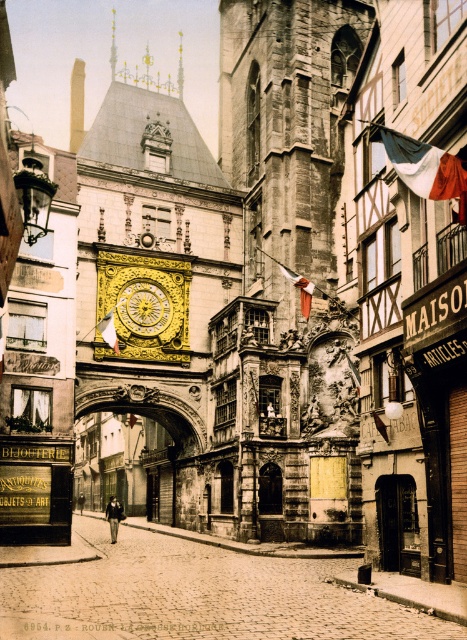
Can you confirm if stone textured tower at center is positioned to the right of gold polished clock at center?

Indeed, stone textured tower at center is positioned on the right side of gold polished clock at center.

Does point (322, 132) come behind point (128, 305)?

That is True.

Where is `stone textured tower at center`? The height and width of the screenshot is (640, 467). stone textured tower at center is located at coordinates (287, 269).

In the scene shown: Can you confirm if gold ornate archway at center is shorter than gold polished clock at center?

No, gold ornate archway at center is not shorter than gold polished clock at center.

Is gold ornate archway at center further to the viewer compared to gold polished clock at center?

No, it is in front of gold polished clock at center.

Which is behind, point (157, 472) or point (154, 332)?

Positioned behind is point (157, 472).

Identify the location of gold ornate archway at center. (125, 465).

Does goldmetallicclock at center have a greater width compared to gold polished clock at center?

Indeed, goldmetallicclock at center has a greater width compared to gold polished clock at center.

Does point (151, 323) come farther from viewer compared to point (134, 301)?

Yes, point (151, 323) is farther from viewer.

Identify the location of goldmetallicclock at center. click(x=143, y=307).